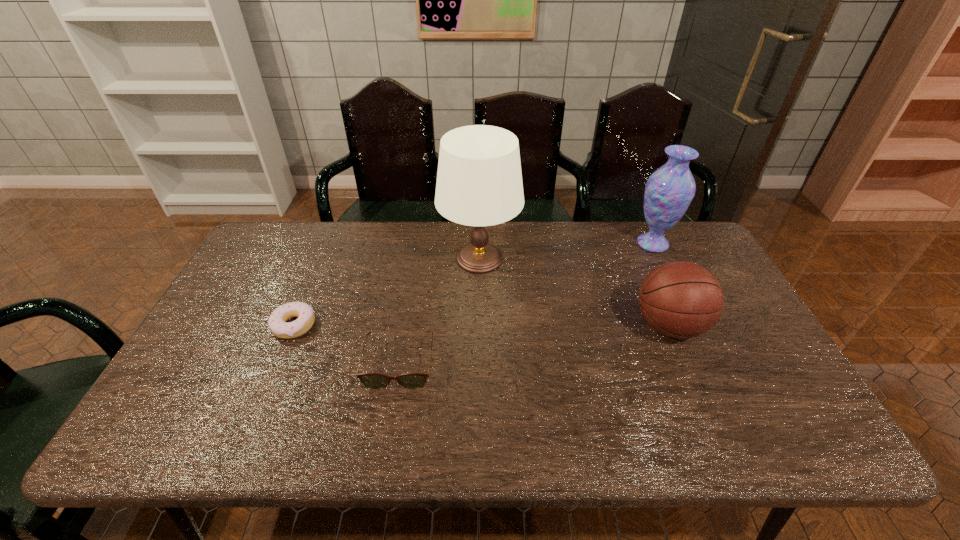
Where is `free space located 0.170m on the front of the leftmost object`? free space located 0.170m on the front of the leftmost object is located at coordinates (264, 397).

The image size is (960, 540). I want to click on lamp located at the far edge, so click(479, 183).

Locate an element on the screen. vase positioned at the far edge is located at coordinates (669, 190).

I want to click on vase present at the right edge, so click(x=669, y=190).

Identify the location of basketball that is positioned at the right edge. (680, 299).

You are a GUI agent. You are given a task and a screenshot of the screen. Output one action in this format:
    pyautogui.click(x=<x>, y=<y>)
    Task: Click on the object that is at the far right corner
    This screenshot has width=960, height=540.
    Given the screenshot: What is the action you would take?
    pyautogui.click(x=669, y=190)

The height and width of the screenshot is (540, 960). I want to click on free region at the far edge of the desktop, so click(x=528, y=245).

I want to click on vacant space at the near edge of the desktop, so click(x=508, y=434).

This screenshot has width=960, height=540. Identify the location of vacant space at the right edge of the desktop. (751, 386).

At what (x,y) coordinates should I click in order to perform the action: click on vacant point at the far left corner. Please return your answer as a coordinate pair (x, y). Image resolution: width=960 pixels, height=540 pixels. Looking at the image, I should click on (309, 220).